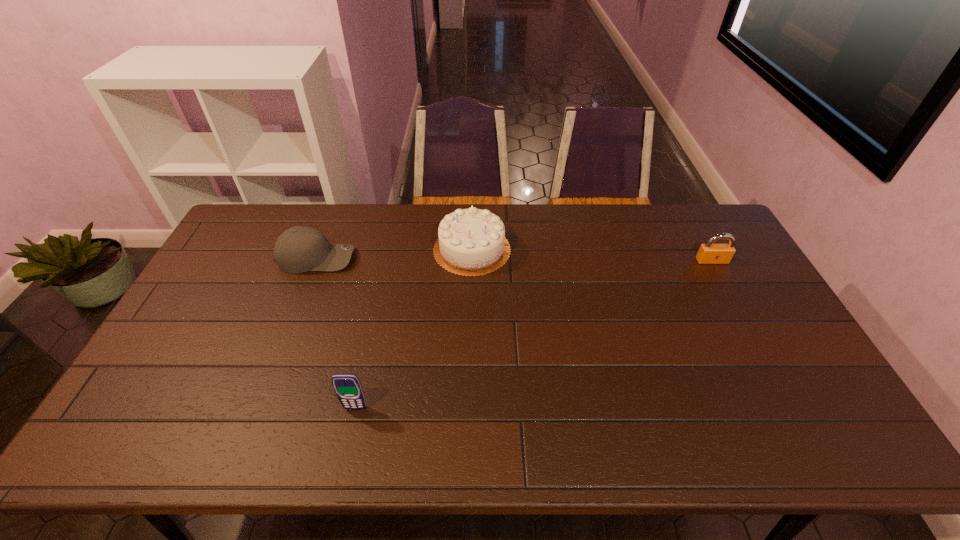
This screenshot has height=540, width=960. I want to click on vacant space that's between the cellular telephone and the birthday cake, so coord(414,329).

Locate an element on the screen. vacant region between the third object from left to right and the leftmost object is located at coordinates (395, 254).

Identify the location of unoccupied position between the birthday cake and the baseball cap. This screenshot has height=540, width=960. (395, 254).

Where is `free spot between the third object from left to right and the third object from right to left`? The image size is (960, 540). free spot between the third object from left to right and the third object from right to left is located at coordinates (414, 329).

This screenshot has width=960, height=540. In order to click on free point between the third object from left to right and the rightmost object in this screenshot , I will do `click(592, 255)`.

Locate an element on the screen. The width and height of the screenshot is (960, 540). unoccupied area between the cellular telephone and the baseball cap is located at coordinates (336, 333).

The image size is (960, 540). I want to click on object that is the third closest one to the padlock, so click(299, 249).

Locate which object is the third closest to the baseball cap. Please provide its 2D coordinates. Your answer should be formatted as a tuple, i.e. [(x, y)], where the tuple contains the x and y coordinates of a point satisfying the conditions above.

[(709, 253)]